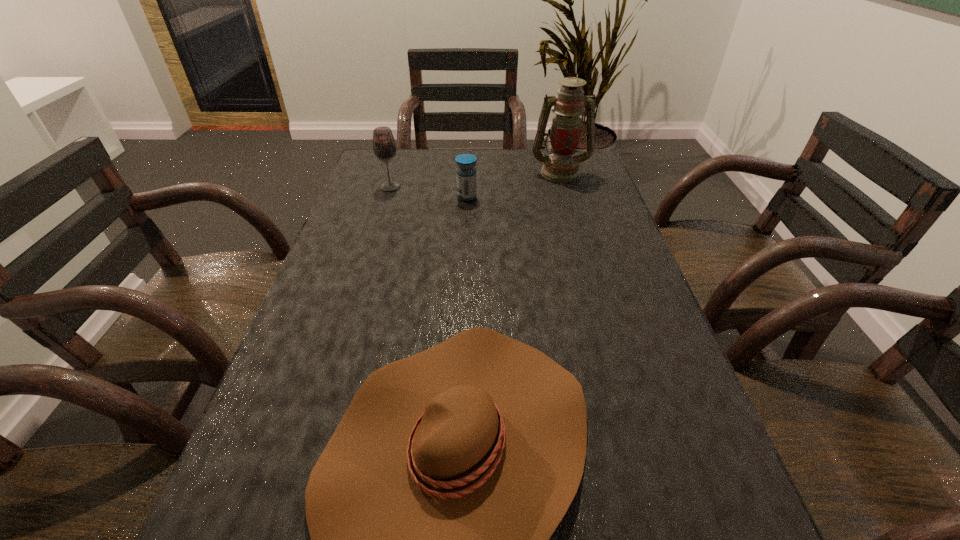
Identify the location of oil lamp. The height and width of the screenshot is (540, 960). (561, 166).

Locate an element on the screen. glass drink container is located at coordinates (384, 146).

What are the coordinates of `the third tallest object` in the screenshot? It's located at (466, 172).

Identify the location of vacant region located on the left of the oil lamp. The image size is (960, 540). (453, 172).

I want to click on free space located 0.070m on the back of the second tallest object, so click(x=396, y=171).

I want to click on vacant region located on the right of the medicine, so click(572, 197).

The image size is (960, 540). Identify the location of oil lamp positioned at the far edge. (561, 166).

You are a GUI agent. You are given a task and a screenshot of the screen. Output one action in this format:
    pyautogui.click(x=<x>, y=<y>)
    Task: Click on the glass drink container located in the far edge section of the desktop
    The image size is (960, 540).
    Given the screenshot: What is the action you would take?
    pyautogui.click(x=384, y=146)

At what (x,y) coordinates should I click in order to perform the action: click on object located in the left edge section of the desktop. Please return your answer as a coordinate pair (x, y). Looking at the image, I should click on (384, 146).

The width and height of the screenshot is (960, 540). Find the location of `object that is at the right edge`. object that is at the right edge is located at coordinates (561, 166).